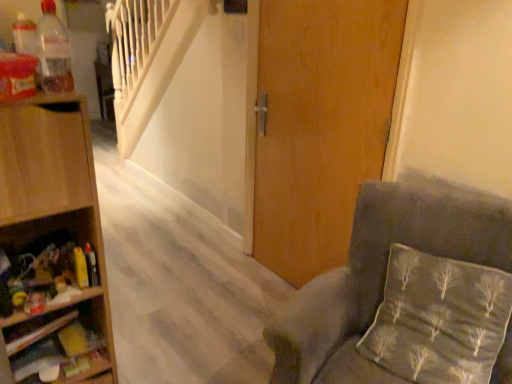
Question: Could you tell me if silky gray pillow at lower right is facing wooden door at center?

Choices:
 (A) yes
 (B) no

Answer: (B)

Question: Is wooden door at center completely or partially inside silky gray pillow at lower right?

Choices:
 (A) no
 (B) yes

Answer: (A)

Question: From the image's perspective, is silky gray pillow at lower right under wooden door at center?

Choices:
 (A) no
 (B) yes

Answer: (B)

Question: Is silky gray pillow at lower right next to wooden door at center?

Choices:
 (A) yes
 (B) no

Answer: (B)

Question: From the image's perspective, is silky gray pillow at lower right over wooden door at center?

Choices:
 (A) yes
 (B) no

Answer: (B)

Question: Is silky gray pillow at lower right taller than wooden door at center?

Choices:
 (A) no
 (B) yes

Answer: (A)

Question: Can you confirm if transparent plastic bottle at upper left is wider than wooden door at center?

Choices:
 (A) yes
 (B) no

Answer: (B)

Question: Is transparent plastic bottle at upper left further to the viewer compared to wooden door at center?

Choices:
 (A) no
 (B) yes

Answer: (A)

Question: Considering the relative positions of transparent plastic bottle at upper left and wooden door at center in the image provided, is transparent plastic bottle at upper left in front of wooden door at center?

Choices:
 (A) no
 (B) yes

Answer: (B)

Question: From the image's perspective, is transparent plastic bottle at upper left on top of wooden door at center?

Choices:
 (A) no
 (B) yes

Answer: (B)

Question: Could wooden door at center be considered to be inside transparent plastic bottle at upper left?

Choices:
 (A) no
 (B) yes

Answer: (A)

Question: Does transparent plastic bottle at upper left have a lesser height compared to wooden door at center?

Choices:
 (A) no
 (B) yes

Answer: (B)

Question: Considering the relative positions of velvet grey chair at lower right and wooden shelf at left, positioned as the first shelf in top-to-bottom order, in the image provided, is velvet grey chair at lower right to the right of wooden shelf at left, positioned as the first shelf in top-to-bottom order, from the viewer's perspective?

Choices:
 (A) yes
 (B) no

Answer: (A)